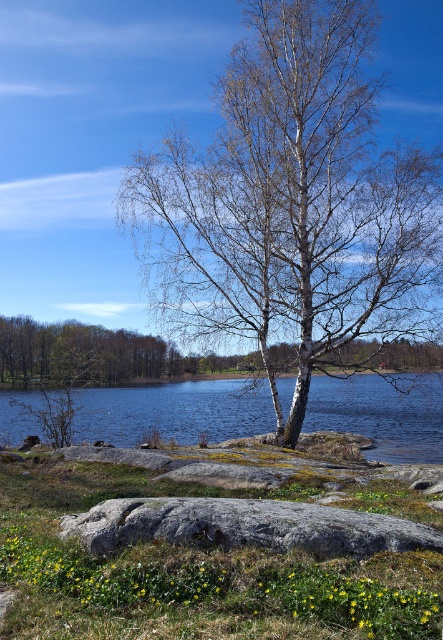
Question: Which point is farther to the camera?

Choices:
 (A) gray/rough rock at center
 (B) white bark birch tree at center
 (C) brown bark tree at center

Answer: (C)

Question: Does gray/rough rock at center have a larger size compared to brown bark tree at center?

Choices:
 (A) no
 (B) yes

Answer: (A)

Question: Does white bark birch tree at center come in front of gray/rough rock at center?

Choices:
 (A) no
 (B) yes

Answer: (A)

Question: Which of the following is the closest to the observer?

Choices:
 (A) gray/rough rock at center
 (B) white bark birch tree at center

Answer: (A)

Question: Is gray/rough rock at center wider than brown bark tree at center?

Choices:
 (A) yes
 (B) no

Answer: (B)

Question: Which of the following is the farthest from the observer?

Choices:
 (A) (129, 349)
 (B) (393, 298)
 (C) (117, 522)

Answer: (A)